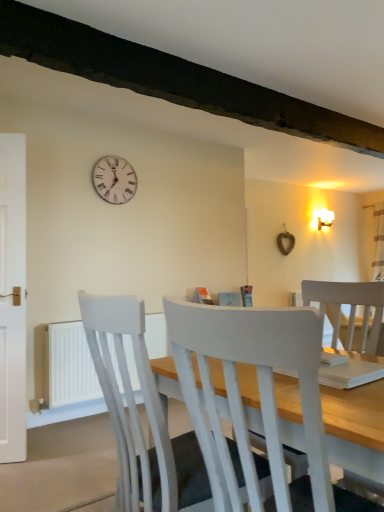
Question: Would you say white painted wood chair at center, which is the first chair in back-to-front order, is to the left or to the right of white plastic radiator at lower left in the picture?

Choices:
 (A) left
 (B) right

Answer: (B)

Question: Is white painted wood chair at center, the second chair from the front, in front of or behind white plastic radiator at lower left in the image?

Choices:
 (A) behind
 (B) front

Answer: (B)

Question: Which of these objects is positioned closest to the white painted wood chair at center, marked as the first chair in a front-to-back arrangement?

Choices:
 (A) white wooden clock at upper center
 (B) white plastic radiator at lower left
 (C) white painted wood chair at center, which is the first chair in back-to-front order

Answer: (C)

Question: Which object is positioned closest to the white painted wood chair at center, marked as the first chair in a front-to-back arrangement?

Choices:
 (A) white painted wood chair at center, the second chair from the front
 (B) white plastic radiator at lower left
 (C) white wooden clock at upper center

Answer: (A)